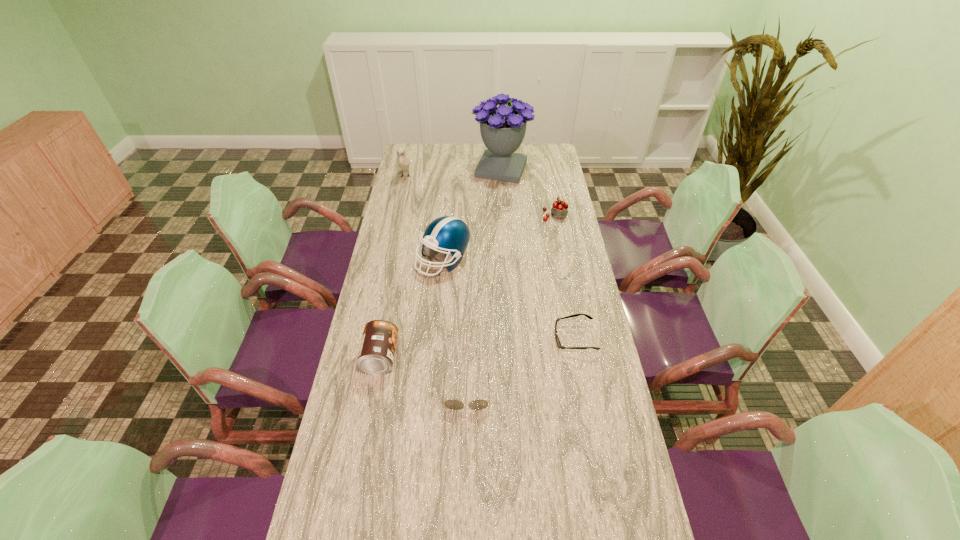
Identify the location of vacant area situated 0.320m at the front of the fourth nearest object with the faceguard. The height and width of the screenshot is (540, 960). (435, 352).

Identify the location of vacant area situated 0.390m at the beak of the bird. (392, 239).

I want to click on vacant point located on the handle side of the fifth nearest object, so coord(547,178).

Where is `vacant position located on the handle side of the fifth nearest object`? The height and width of the screenshot is (540, 960). vacant position located on the handle side of the fifth nearest object is located at coordinates (550, 195).

Locate an element on the screen. vacant position located 0.180m on the handle side of the fifth nearest object is located at coordinates (548, 184).

This screenshot has height=540, width=960. What are the coordinates of `blank space located on the front label of the can` in the screenshot? It's located at (473, 357).

Where is `free space located on the lenses of the taller sunglasses`? free space located on the lenses of the taller sunglasses is located at coordinates (466, 438).

Where is `vacant space situated on the lenses of the shortest object`? vacant space situated on the lenses of the shortest object is located at coordinates (539, 338).

Locate an element on the screen. The image size is (960, 540). free location located on the lenses of the shortest object is located at coordinates (536, 338).

I want to click on vacant space located on the lenses of the shortest object, so click(x=468, y=338).